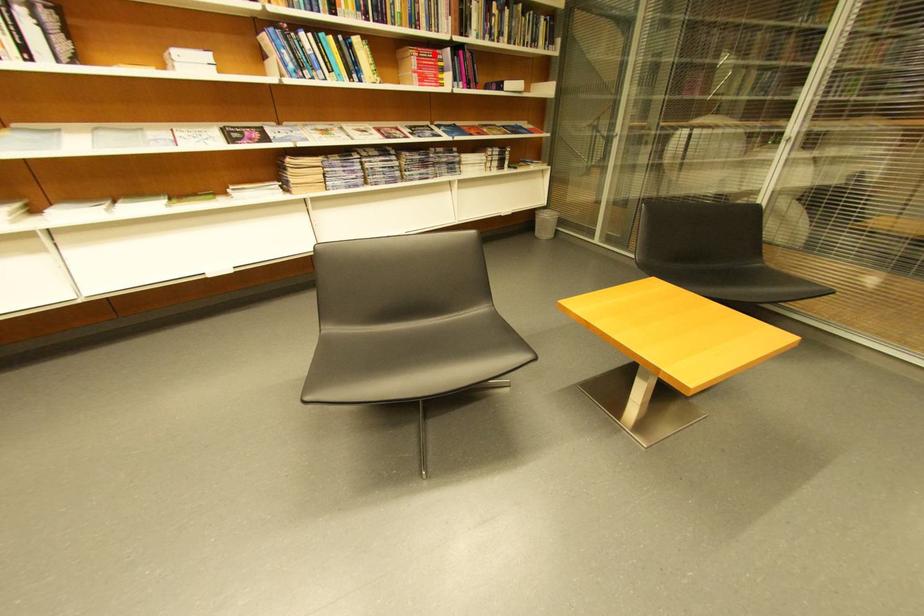
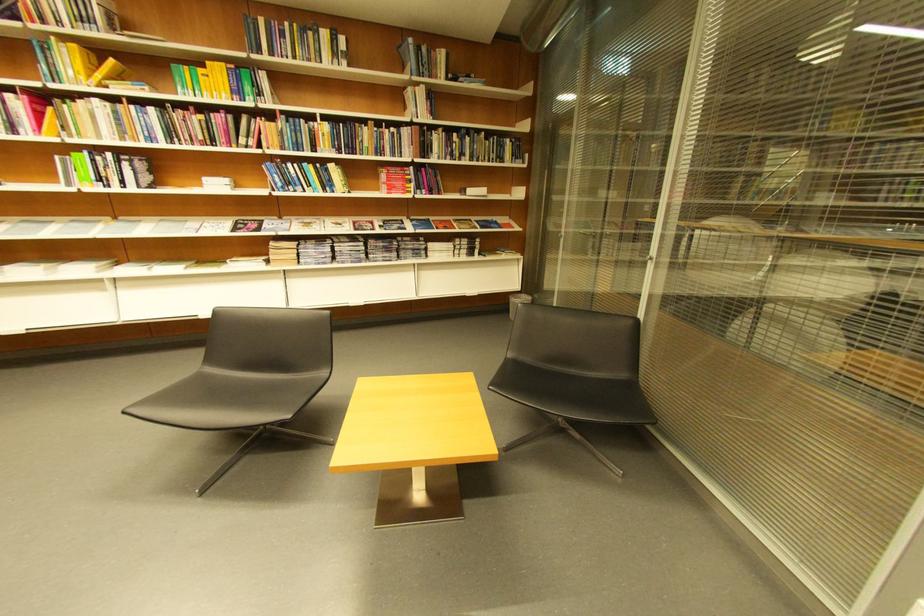
The point at the highlighted location is marked in the first image. Where is the corresponding point in the second image?

(403, 172)